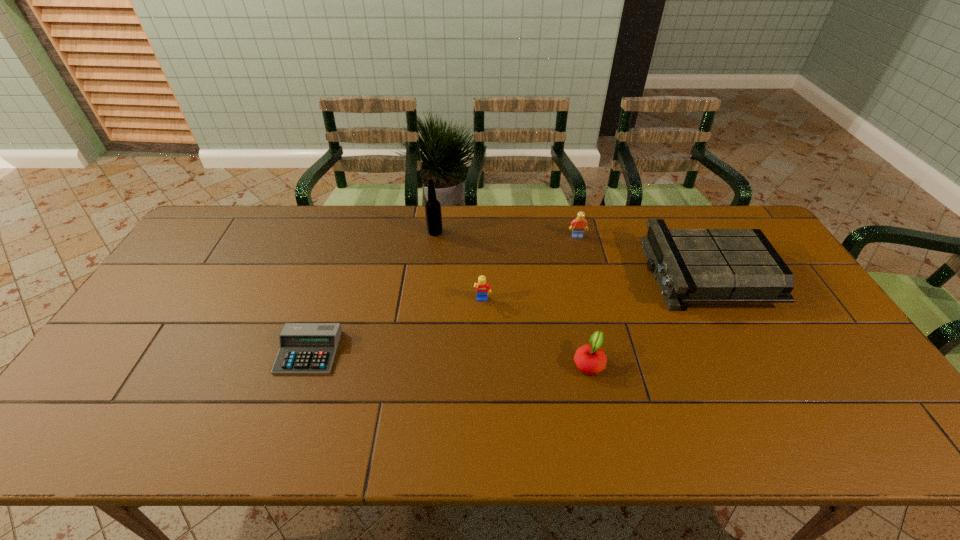
This screenshot has width=960, height=540. Identify the location of beer bottle. (433, 213).

Locate an element on the screen. This screenshot has height=540, width=960. the tallest object is located at coordinates (433, 213).

The width and height of the screenshot is (960, 540). What are the coordinates of `the farther Lego` in the screenshot? It's located at (578, 225).

This screenshot has height=540, width=960. Find the location of `the rightmost object`. the rightmost object is located at coordinates (690, 265).

The image size is (960, 540). Identify the location of the left Lego. (482, 287).

Locate an element on the screen. The width and height of the screenshot is (960, 540). the third object from left to right is located at coordinates (482, 287).

Image resolution: width=960 pixels, height=540 pixels. I want to click on apple, so click(590, 359).

I want to click on calculator, so click(304, 348).

Locate an element on the screen. The width and height of the screenshot is (960, 540). the shortest object is located at coordinates (304, 348).

The width and height of the screenshot is (960, 540). I want to click on free location located on the front of the second object from left to right, so click(429, 281).